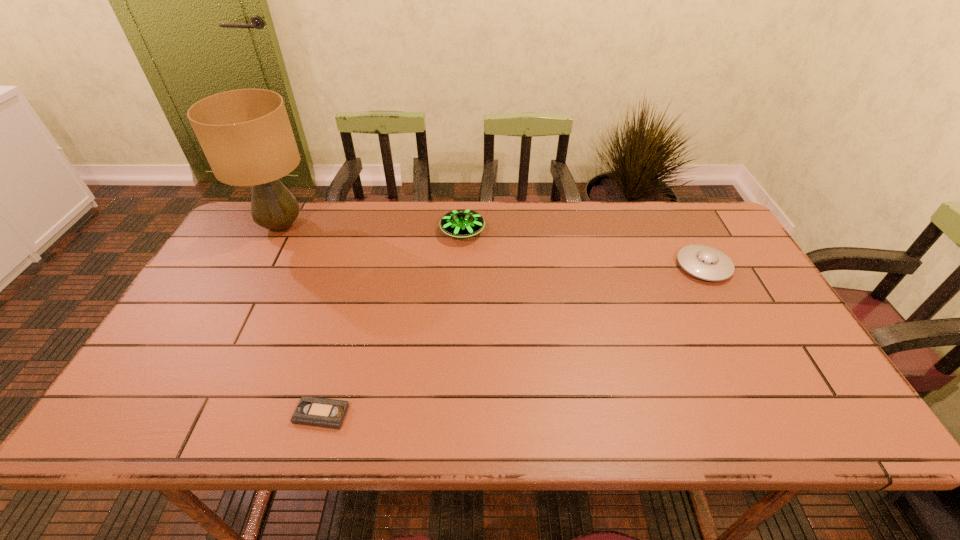
At what (x,y) coordinates should I click in order to perform the action: click on free area in between the second shortest object and the shortest object. Please return your answer as a coordinate pair (x, y). This screenshot has width=960, height=540. Looking at the image, I should click on (513, 340).

Where is `free area in between the lampshade and the rightmost object`? free area in between the lampshade and the rightmost object is located at coordinates (492, 246).

Locate an element on the screen. This screenshot has width=960, height=540. free point between the shorter saucer and the nearest object is located at coordinates pos(513,340).

At what (x,y) coordinates should I click in order to perform the action: click on object that is the third closest to the rightmost object. Please return your answer as a coordinate pair (x, y). The height and width of the screenshot is (540, 960). Looking at the image, I should click on (246, 136).

I want to click on object that is the second closest to the farther saucer, so click(x=311, y=411).

Find the location of a particular element. The image size is (960, 540). free space that satisfies the following two spatial constraints: 1. on the back side of the nearest object; 2. on the left side of the left saucer is located at coordinates (372, 232).